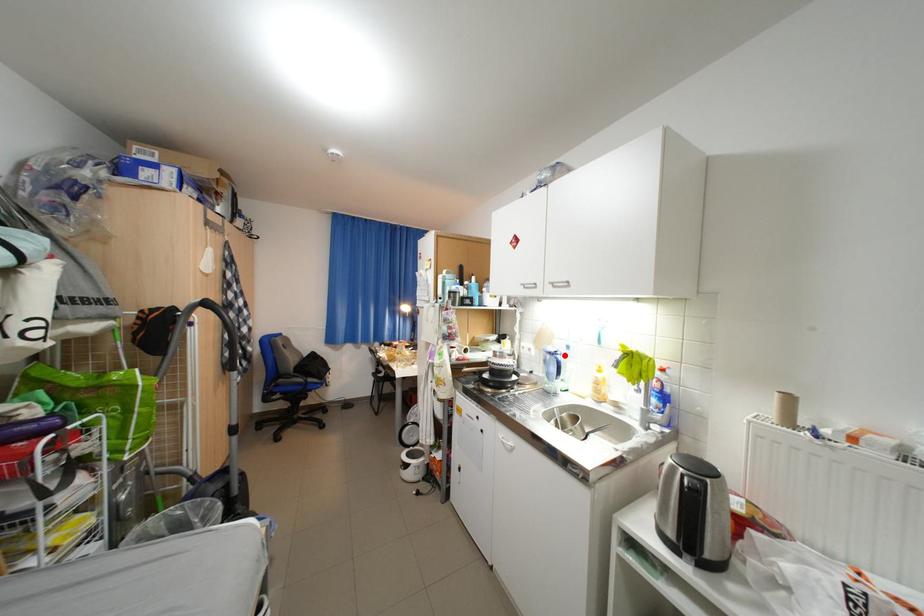
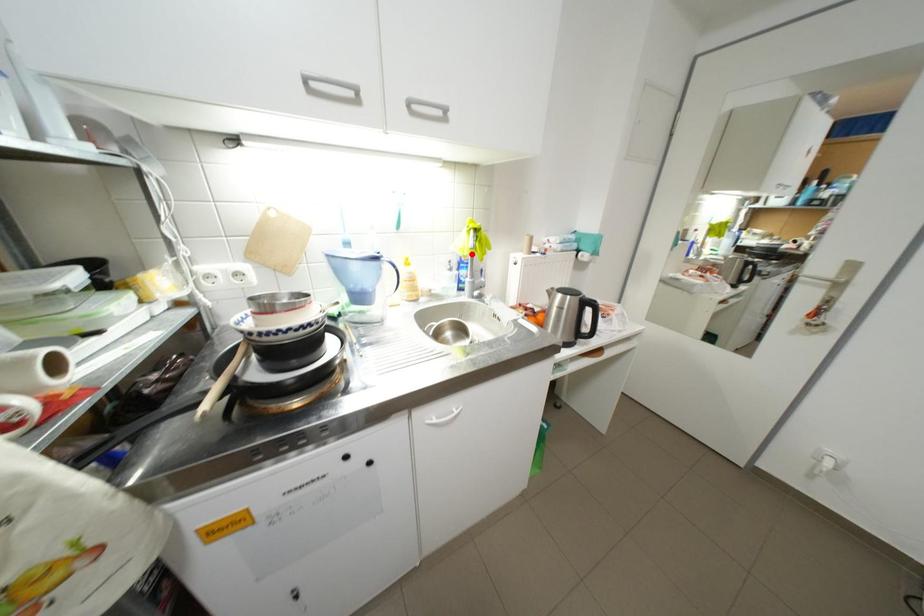
I am providing you with two images of the same scene from different viewpoints. A red point is marked on the first image and another point is marked on the second image. Is the red point in image1 aligned with the point shown in image2?

No